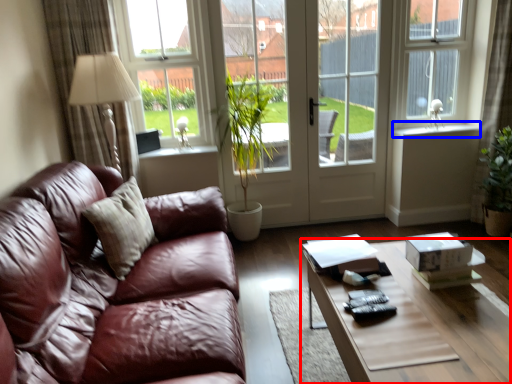
Question: Which of the following is the closest to the observer, coffee table (highlighted by a red box) or window sill (highlighted by a blue box)?

Choices:
 (A) coffee table
 (B) window sill

Answer: (A)